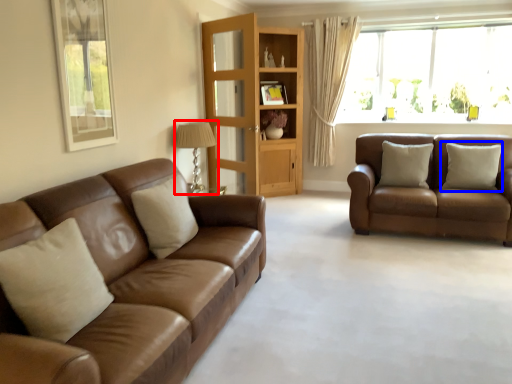
Question: Which object is closer to the camera taking this photo, lamp (highlighted by a red box) or pillow (highlighted by a blue box)?

Choices:
 (A) lamp
 (B) pillow

Answer: (A)